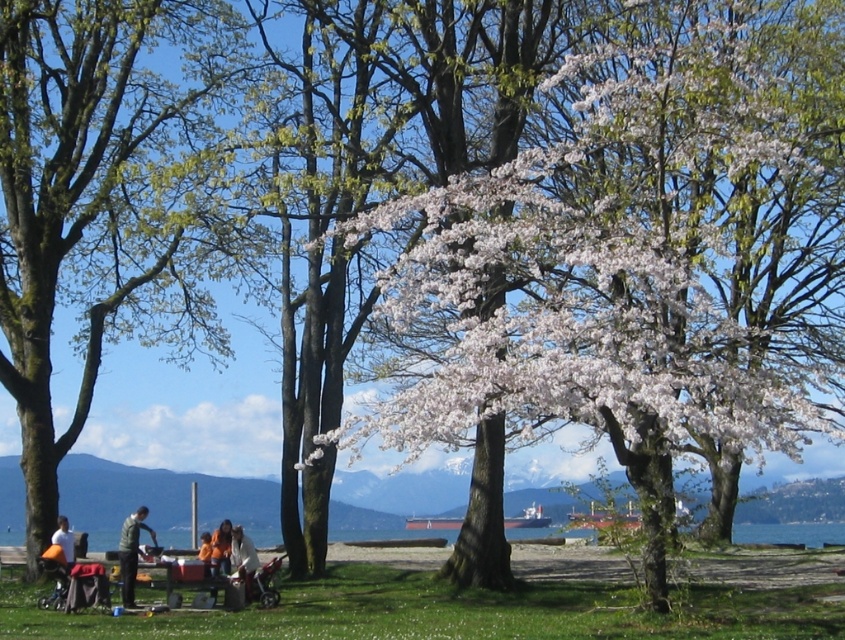
You are standing in the park and see the white blossoming tree at center and the green fabric jacket at center. Which object is taller?

The white blossoming tree at center is taller than the green fabric jacket at center.

You are a photographer standing at the edge of the park, looking towards the picnic area. You want to take a photo that includes both the white cotton shirt at center and the orange fabric jacket at lower center. Which clothing item will appear smaller in the photo?

The white cotton shirt at center will appear smaller in the photo because it is shorter than the orange fabric jacket at lower center.